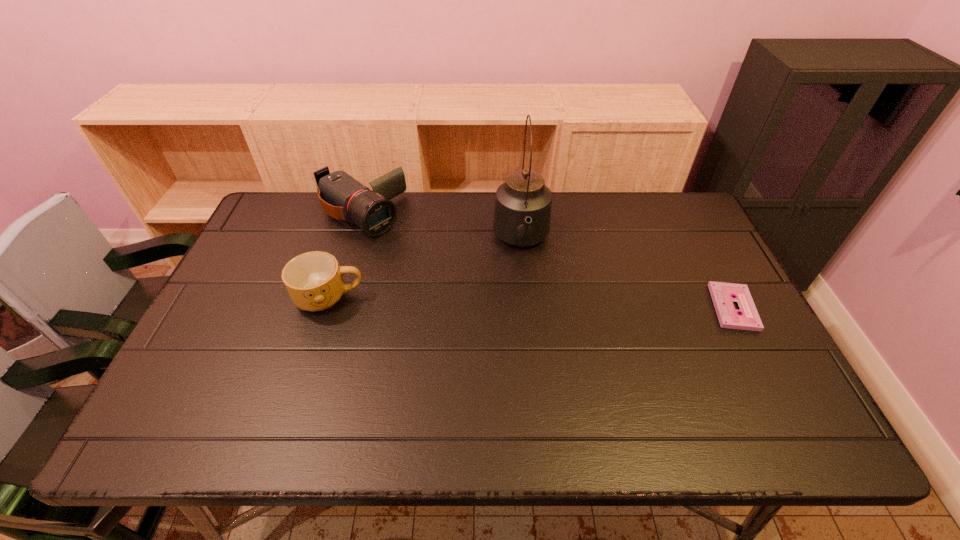
I want to click on free space located 0.340m on the lens of the camcorder, so click(x=462, y=291).

Where is `free location located 0.100m spout on the second object from right to left`? The image size is (960, 540). free location located 0.100m spout on the second object from right to left is located at coordinates (527, 294).

I want to click on free location located spout on the second object from right to left, so click(x=529, y=317).

Where is `free space located spout on the second object from right to left`? The height and width of the screenshot is (540, 960). free space located spout on the second object from right to left is located at coordinates (533, 352).

Locate an element on the screen. The image size is (960, 540). camcorder situated at the far edge is located at coordinates (341, 196).

The width and height of the screenshot is (960, 540). What are the coordinates of `kettle that is at the far edge` in the screenshot? It's located at (522, 214).

Image resolution: width=960 pixels, height=540 pixels. I want to click on object at the left edge, so click(x=341, y=196).

Find the location of a particular element. object that is at the right edge is located at coordinates pos(723,294).

Locate an element on the screen. This screenshot has height=540, width=960. object present at the far left corner is located at coordinates 341,196.

Locate an element on the screen. free space at the far edge of the desktop is located at coordinates (390, 234).